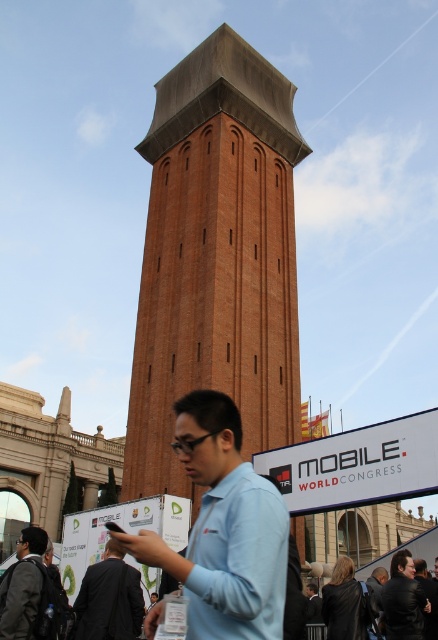
You are a fashion designer observing the scene. You need to determine the spatial relationship between the dark gray suit at center and the black leather jacket at lower right. Which one is positioned higher in the image?

The dark gray suit at center is located above the black leather jacket at lower right, so it is positioned higher in the image.

You are a tourist in Venice and see the brown brick tower at center and the matte blue shirt at center. Which object is higher in the image?

The brown brick tower at center is located above the matte blue shirt at center, so it is higher in the image.